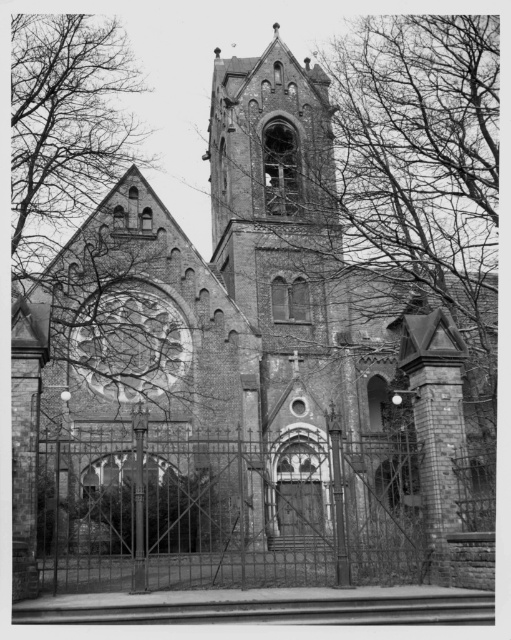
Does point (121, 465) come in front of point (20, 214)?

Yes, it is in front of point (20, 214).

At what (x,y) coordinates should I click in order to perform the action: click on iron gate at center. Please return your answer as a coordinate pair (x, y). The height and width of the screenshot is (640, 511). Looking at the image, I should click on (285, 515).

Find the location of a particular element. iron gate at center is located at coordinates (285, 515).